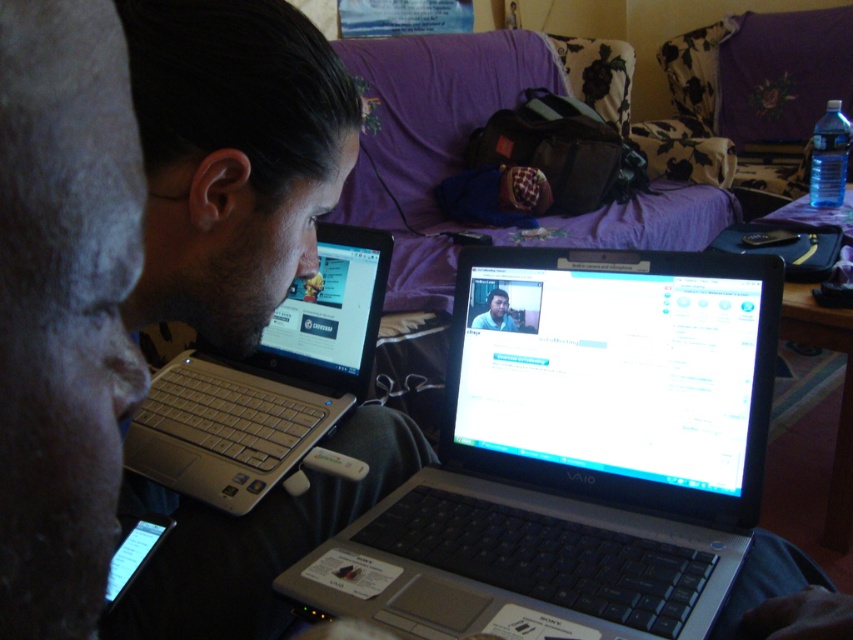
Question: Is matte black laptop at left closer to camera compared to matte black laptop at center?

Choices:
 (A) no
 (B) yes

Answer: (B)

Question: Does purple fabric couch at upper center lie behind matte black laptop at center?

Choices:
 (A) yes
 (B) no

Answer: (A)

Question: Which of the following is the closest to the observer?

Choices:
 (A) (509, 317)
 (B) (271, 467)
 (C) (196, 145)
 (D) (254, 332)

Answer: (C)

Question: Which object is closer to the camera taking this photo?

Choices:
 (A) matte black laptop at center
 (B) purple fabric couch at upper center
 (C) matte silver laptop at left
 (D) matte black laptop at left

Answer: (C)

Question: Which of the following is the closest to the observer?

Choices:
 (A) (700, 529)
 (B) (376, 326)

Answer: (A)

Question: Is black plastic laptop at center to the left of silver metallic laptop at left from the viewer's perspective?

Choices:
 (A) no
 (B) yes

Answer: (A)